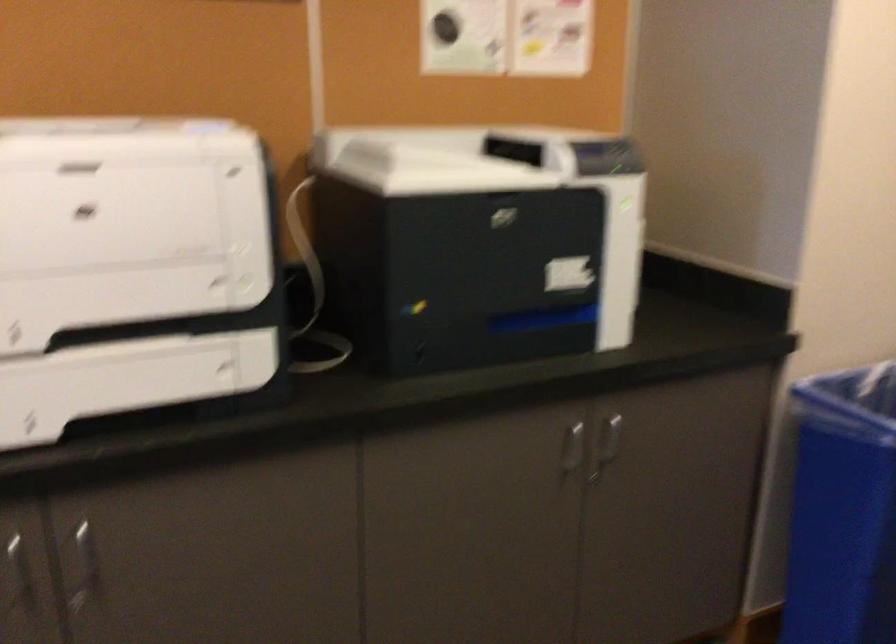
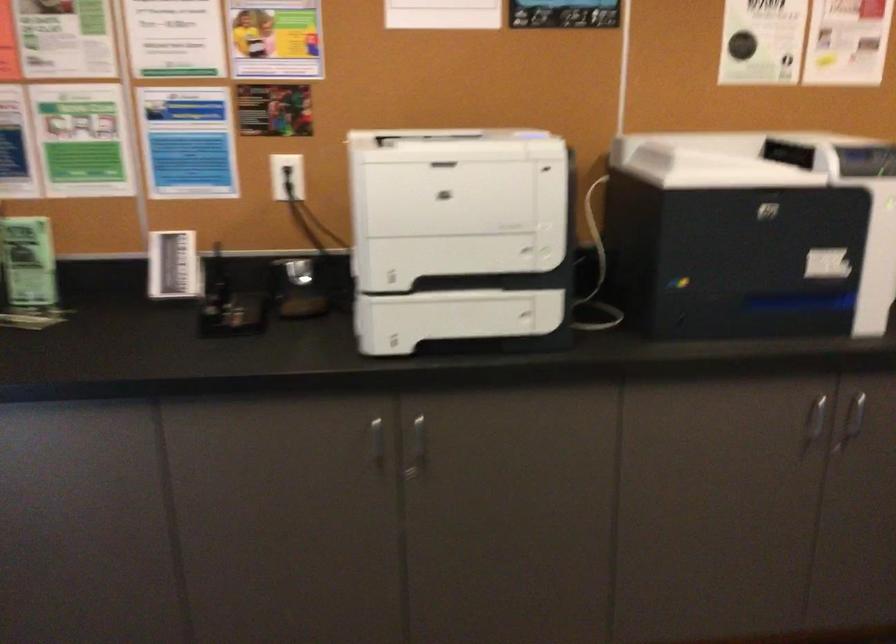
Question: I am providing you with two images of the same scene from different viewpoints. After the viewpoint changes to image2, which objects are now occluded?

Choices:
 (A) silver cabinet handle
 (B) printer lid
 (C) electrical wall outlet
 (D) none of these

Answer: (D)